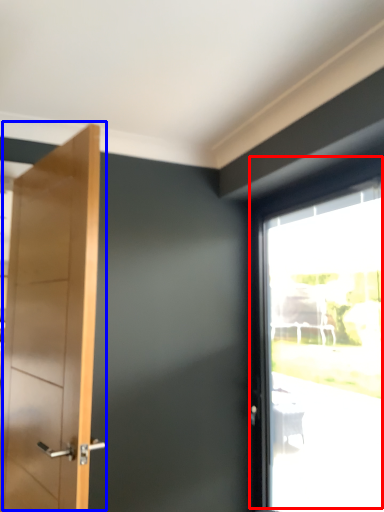
Question: Among these objects, which one is nearest to the camera, window (highlighted by a red box) or door (highlighted by a blue box)?

Choices:
 (A) window
 (B) door

Answer: (B)